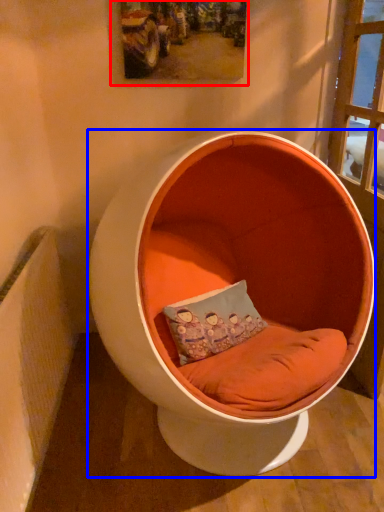
Question: Which object appears closest to the camera in this image, picture frame (highlighted by a red box) or furniture (highlighted by a blue box)?

Choices:
 (A) picture frame
 (B) furniture

Answer: (B)